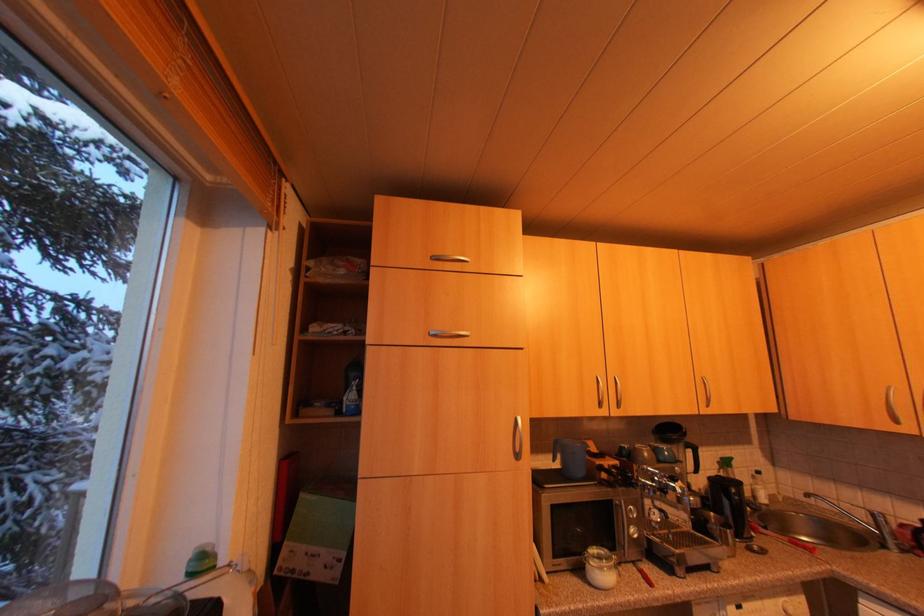
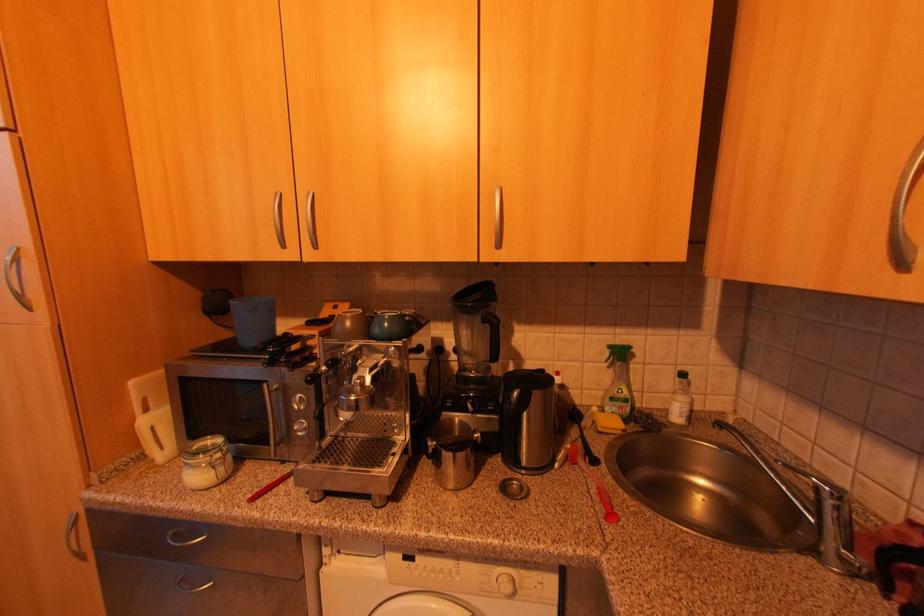
What movement of the cameraman would produce the second image?

The movement direction of the cameraman is right, forward.